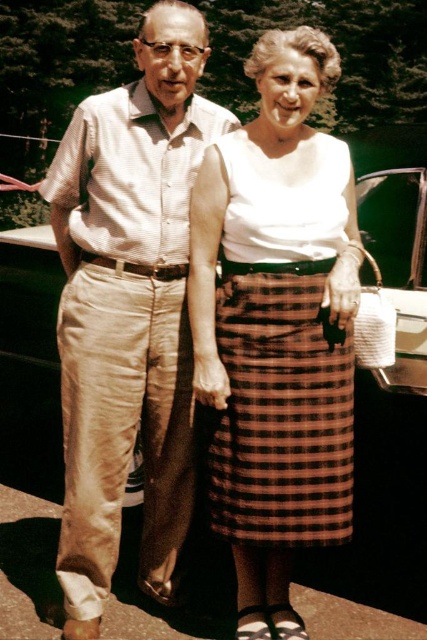
You are standing in front of the two people in the scene and want to place a small flower between them. The flower must be placed exactly at the midpoint between point (53, 196) and point (263, 476). Will the flower be closer to the man or the woman?

The flower placed at the midpoint between point (53, 196) and point (263, 476) will be closer to the man because point (53, 196) is closer to the viewer than point (263, 476).

You are standing at the origin point of the coordinate system in the image. The light beige cotton pants at left are located at a specific coordinate. Can you determine their exact coordinates?

The light beige cotton pants at left are located at coordinates point (128, 308).